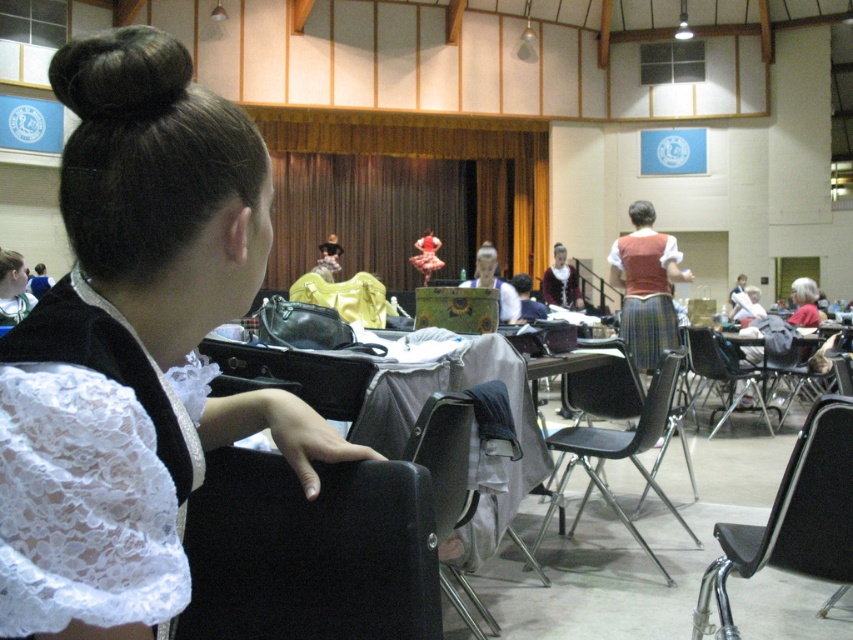
You are a photographer setting up for an event in the room. You need to ensure that the plaid skirt at center and the black plastic chair at center are both visible in your shot. Given their heights, which object might block the view of the other if positioned directly in front?

The plaid skirt at center is taller than the black plastic chair at center, so if positioned directly in front, the plaid skirt at center could block the view of the black plastic chair at center.

You are sitting in the black plastic chair at center and want to hand a document to the person wearing the plaid skirt at center. In which direction should you pass the document?

You should pass the document to your right since the plaid skirt at center is located to the right of the black plastic chair at center.

You are sitting in the black leather chair at lower center and want to reach the metallic silver table at center to grab a pen. Can you easily reach the table from your current position?

Yes, since the black leather chair at lower center is in front of the metallic silver table at center, you can easily reach the table from your current position.